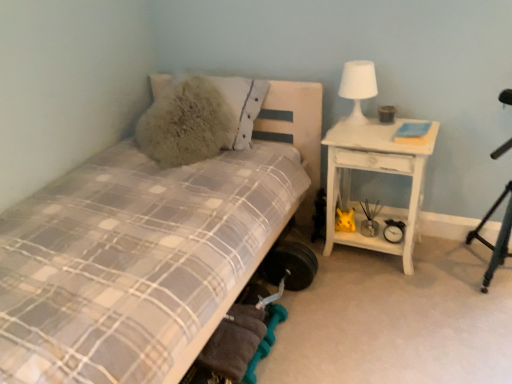
You are a GUI agent. You are given a task and a screenshot of the screen. Output one action in this format:
    pyautogui.click(x=<x>, y=<y>)
    Task: Click on the vacant region to the right of white wood nightstand at right
    The width and height of the screenshot is (512, 384).
    Given the screenshot: What is the action you would take?
    pyautogui.click(x=441, y=258)